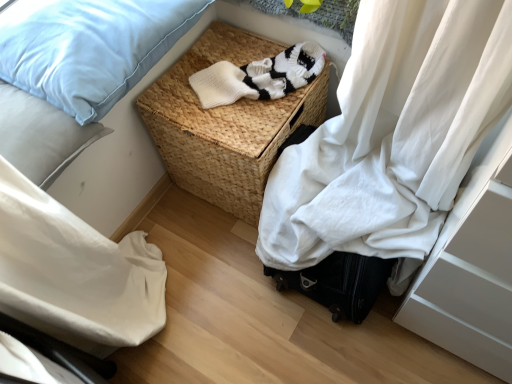
The image size is (512, 384). I want to click on free spot in front of woven brown picnic basket at center, so click(x=220, y=283).